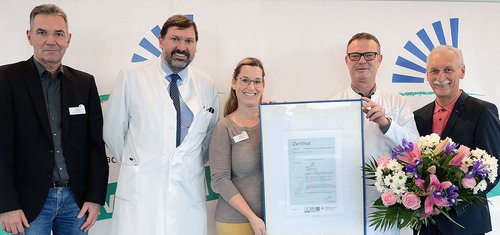
You are a GUI agent. You are given a task and a screenshot of the screen. Output one action in this format:
    pyautogui.click(x=<x>, y=<y>)
    Task: Click on the plaque
    The width and height of the screenshot is (500, 235).
    Given the screenshot: What is the action you would take?
    pyautogui.click(x=328, y=155)